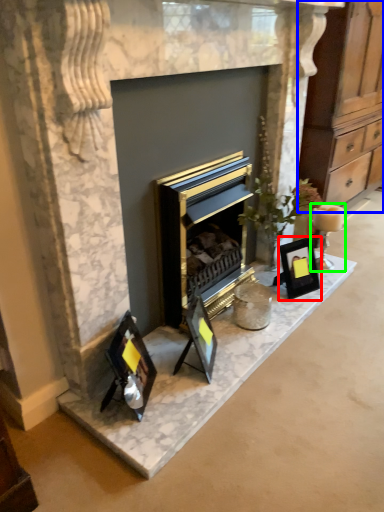
Question: Estimate the real-world distances between objects in this image. Which object is closer to picture frame (highlighted by a red box), dresser (highlighted by a blue box) or candle holder (highlighted by a green box)?

Choices:
 (A) dresser
 (B) candle holder

Answer: (B)